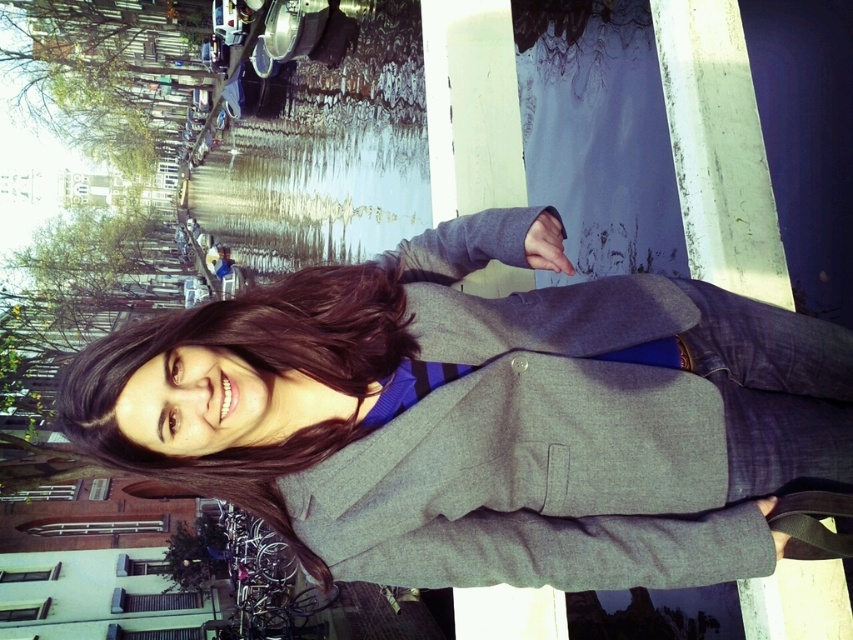
Can you confirm if gray woolen blazer at center is thinner than dark brown hair at center?

No.

Which is more to the right, gray woolen blazer at center or dark brown hair at center?

Positioned to the right is gray woolen blazer at center.

This screenshot has height=640, width=853. I want to click on gray woolen blazer at center, so click(x=482, y=416).

Locate an element on the screen. This screenshot has height=640, width=853. gray woolen blazer at center is located at coordinates (482, 416).